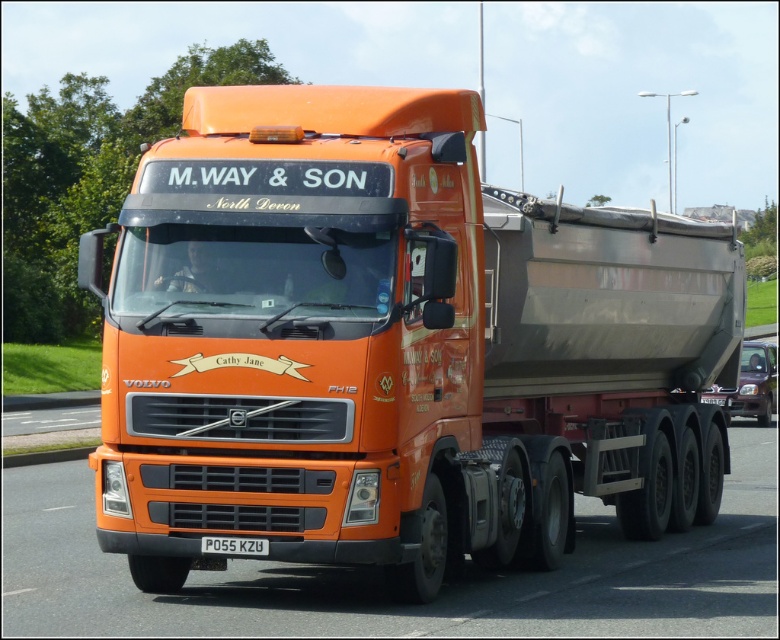
Question: Observing the image, what is the correct spatial positioning of orange matte truck at center in reference to red plastic license plate at center?

Choices:
 (A) right
 (B) left

Answer: (A)

Question: Can you confirm if orange matte truck at center is positioned to the left of red plastic license plate at center?

Choices:
 (A) yes
 (B) no

Answer: (B)

Question: Which point is farther to the camera?

Choices:
 (A) orange matte truck at center
 (B) red plastic license plate at center

Answer: (B)

Question: Which point is farther to the camera?

Choices:
 (A) (211, 550)
 (B) (624, 218)

Answer: (B)

Question: Can you confirm if orange matte truck at center is positioned to the left of red plastic license plate at center?

Choices:
 (A) yes
 (B) no

Answer: (B)